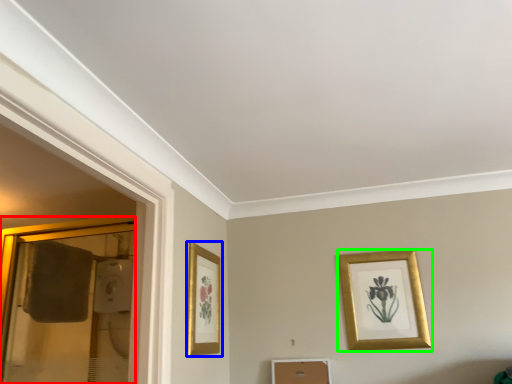
Question: Which object is positioned farthest from glass door (highlighted by a red box)? Select from picture frame (highlighted by a blue box) and picture frame (highlighted by a green box).

Choices:
 (A) picture frame
 (B) picture frame

Answer: (B)